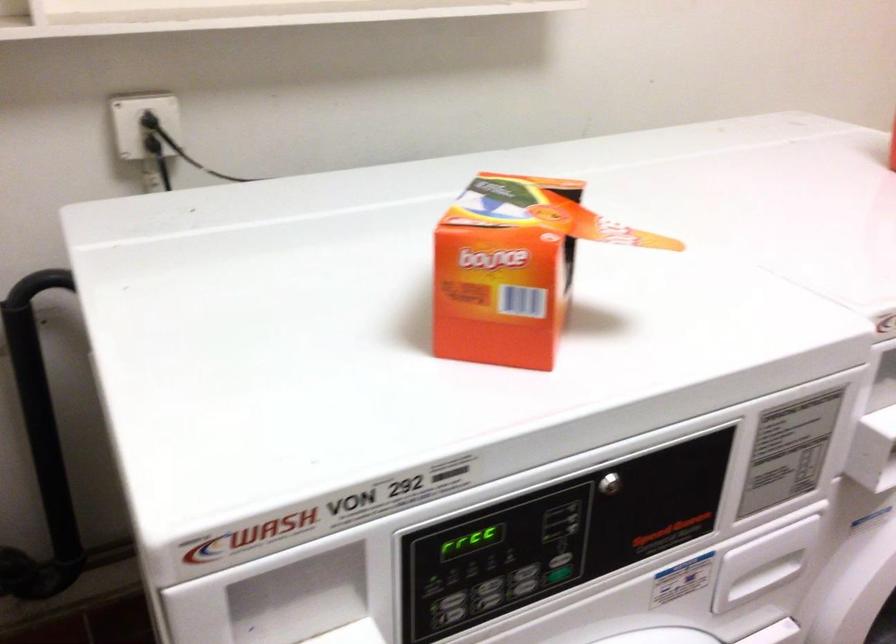
Where is `white drawer handle`? This screenshot has width=896, height=644. white drawer handle is located at coordinates (762, 576).